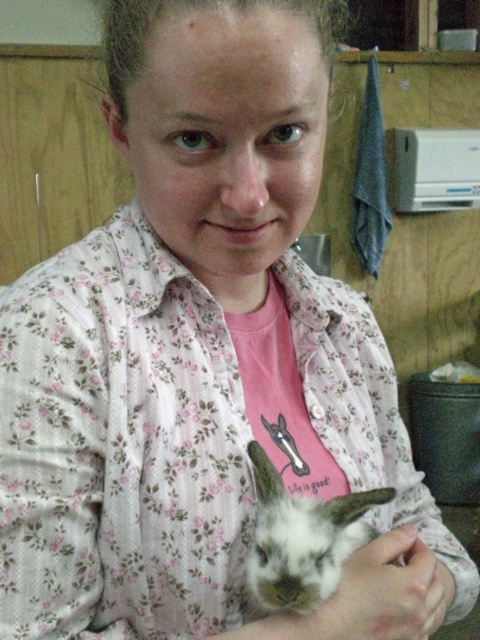
You are a photographer trying to capture a closeup shot of the white fur rabbit at center. You notice the white matte hand at lower center is blocking part of the rabbit. Can you adjust your position to get a clearer view of the rabbit without moving the hand?

The white fur rabbit at center is closer to the viewer than the white matte hand at lower center. By moving your camera position slightly forward or adjusting the angle, you can focus on the rabbit while minimizing the obstruction from the hand.

You are a veterinarian examining a patient. You notice the white fur rabbit at center and the white matte hand at lower center in the image. Which object has a smaller width?

The white fur rabbit at center is thinner than the white matte hand at lower center, so the white fur rabbit at center has a smaller width.